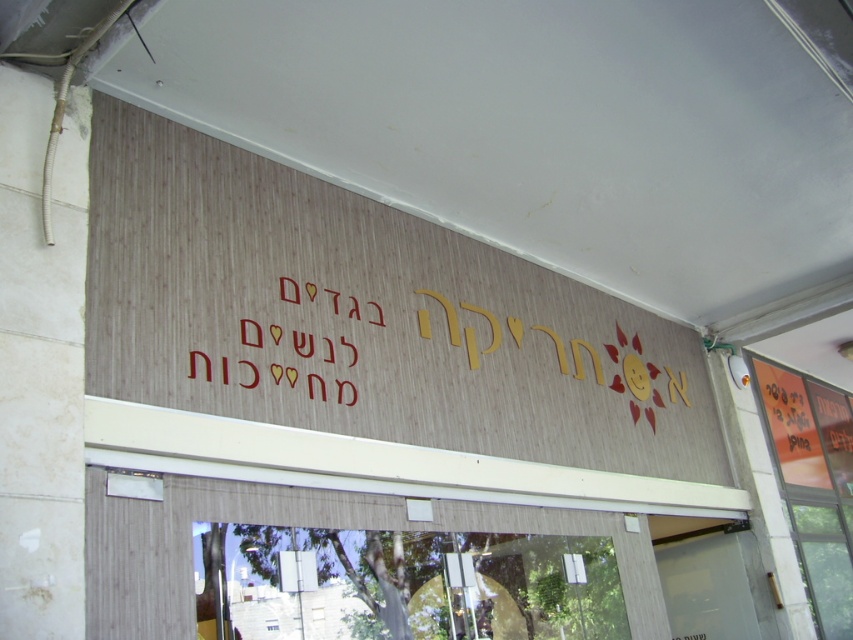
Does point (410, 296) come farther from viewer compared to point (711, 611)?

No, it is in front of (711, 611).

Is the position of wooden signboard at upper center more distant than that of transparent glass door at lower center?

No, it is not.

At what (x,y) coordinates should I click in order to perform the action: click on wooden signboard at upper center. Please return your answer as a coordinate pair (x, y). This screenshot has width=853, height=640. Looking at the image, I should click on coord(363,317).

This screenshot has width=853, height=640. Find the location of `wooden signboard at upper center`. wooden signboard at upper center is located at coordinates (363, 317).